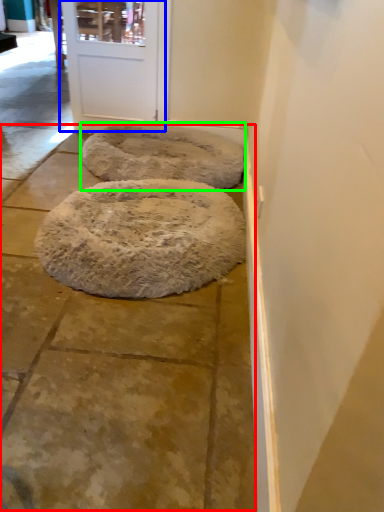
Question: Which object is the farthest from pavement (highlighted by a red box)? Choose among these: door (highlighted by a blue box) or dog bed (highlighted by a green box).

Choices:
 (A) door
 (B) dog bed

Answer: (A)